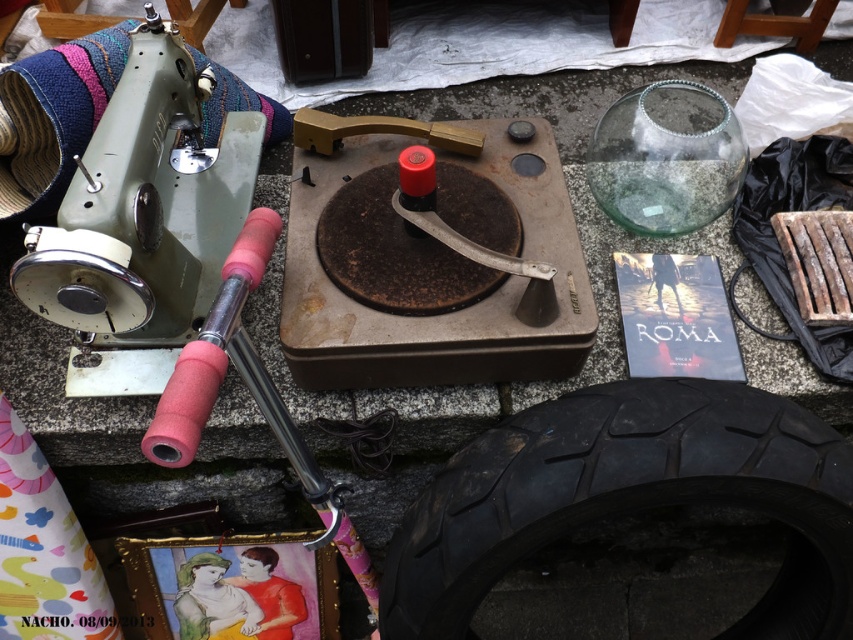
Question: Can you confirm if black rubber tire at bottom right is wider than matte green sewing machine at left?

Choices:
 (A) yes
 (B) no

Answer: (A)

Question: Which of the following is the closest to the observer?

Choices:
 (A) pink foam hammer at upper left
 (B) black rubber tire at bottom right

Answer: (A)

Question: Does black rubber tire at bottom right have a greater width compared to pink foam hammer at upper left?

Choices:
 (A) yes
 (B) no

Answer: (A)

Question: Which point is farther to the camera?

Choices:
 (A) (244, 216)
 (B) (636, 413)

Answer: (A)

Question: Is black rubber tire at bottom right positioned at the back of pink foam hammer at upper left?

Choices:
 (A) yes
 (B) no

Answer: (A)

Question: Among these objects, which one is farthest from the camera?

Choices:
 (A) matte green sewing machine at left
 (B) black rubber tire at bottom right

Answer: (B)